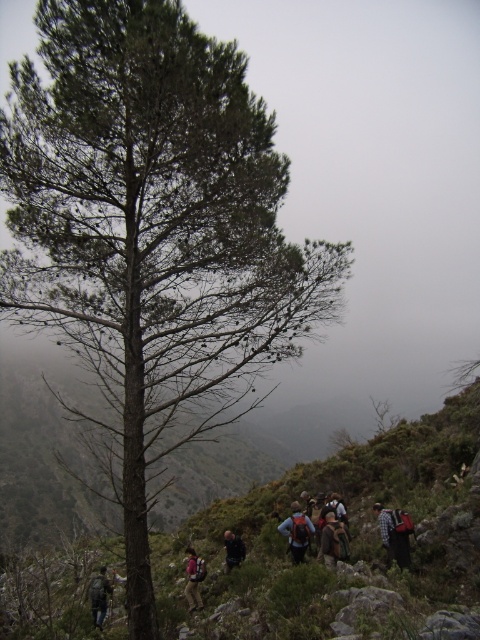
Question: Where is matte brown backpack at center located in relation to dark gray backpack at center in the image?

Choices:
 (A) right
 (B) left

Answer: (B)

Question: Which object is farther from the camera taking this photo?

Choices:
 (A) plaid flannel shirt at lower right
 (B) dark blue backpack at center

Answer: (B)

Question: Is green rough bark tree at center wider than dark blue backpack at center?

Choices:
 (A) yes
 (B) no

Answer: (A)

Question: From the image, what is the correct spatial relationship of green rough bark tree at center in relation to plaid flannel shirt at lower right?

Choices:
 (A) left
 (B) right

Answer: (A)

Question: Based on their relative distances, which object is nearer to the red backpack at lower right?

Choices:
 (A) matte brown backpack at center
 (B) blue fabric backpack at center

Answer: (B)

Question: Which of the following is the closest to the observer?

Choices:
 (A) green rough bark tree at center
 (B) dark blue backpack at center
 (C) matte brown backpack at center

Answer: (A)